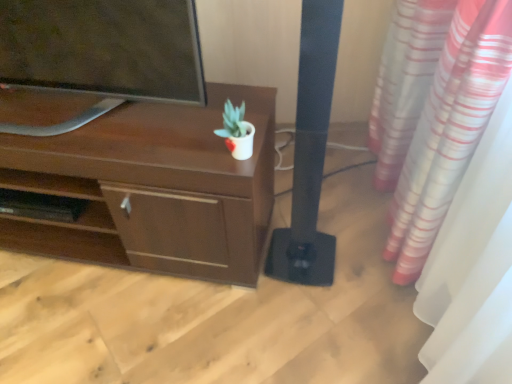
Image resolution: width=512 pixels, height=384 pixels. Identify the location of blank area beneath matte black tv at upper left (from a real-world perspective). (100, 122).